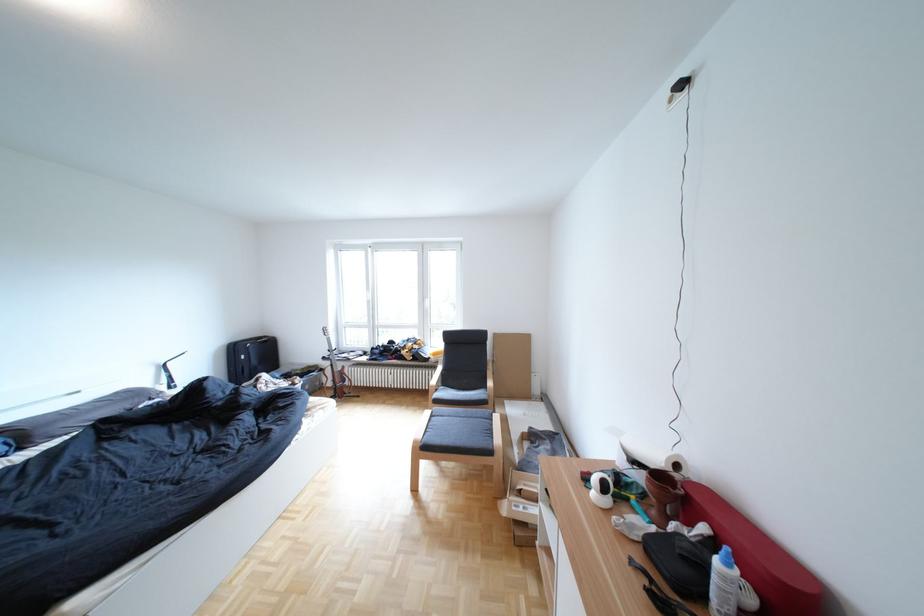
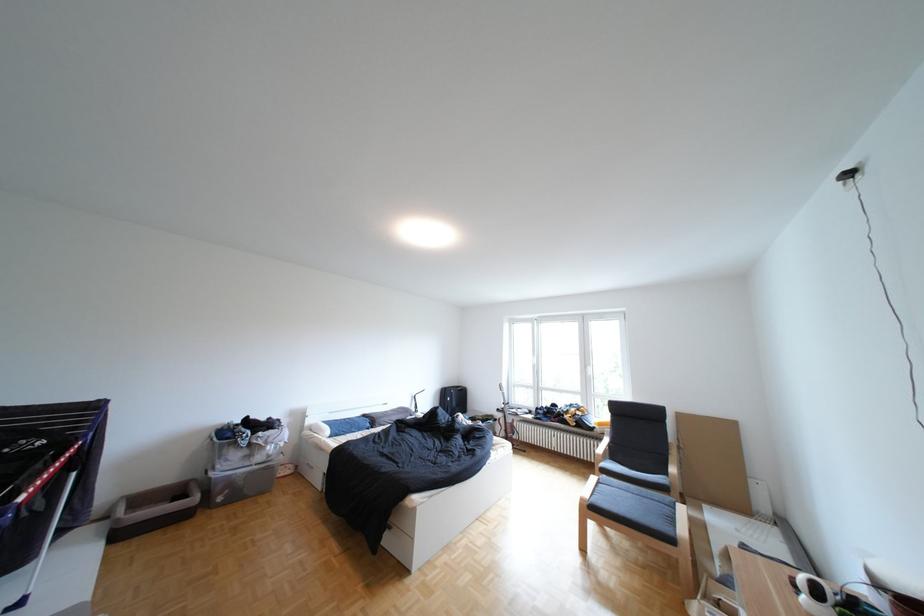
Question: How did the camera likely rotate?

Choices:
 (A) Left
 (B) Right
 (C) Up
 (D) Down

Answer: (A)